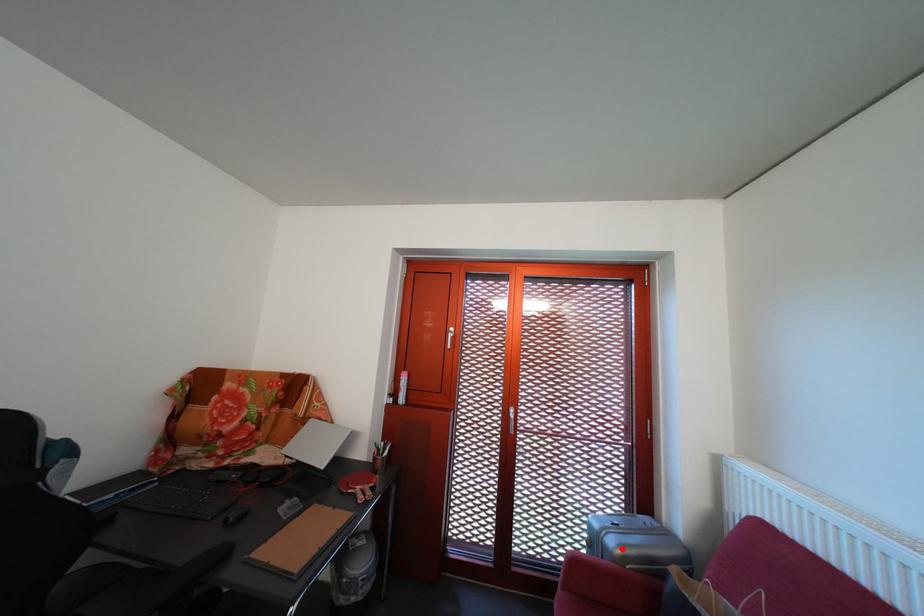
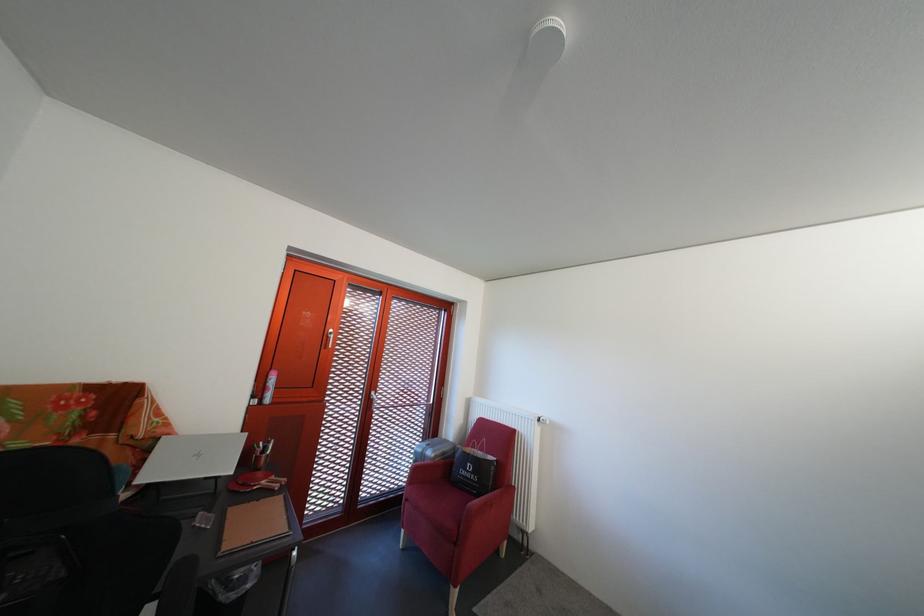
Question: I am providing you with two images of the same scene from different viewpoints. A red point is shown in image1. For the corresponding object point in image2, is it positioned nearer or farther from the camera?

Choices:
 (A) Nearer
 (B) Farther

Answer: (B)